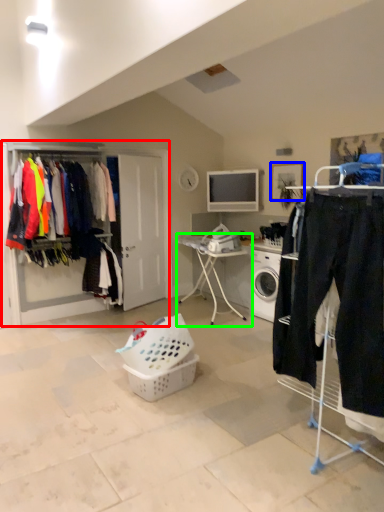
Question: Which is farther away from dresser (highlighted by a red box)? picture frame (highlighted by a blue box) or desk (highlighted by a green box)?

Choices:
 (A) picture frame
 (B) desk

Answer: (A)